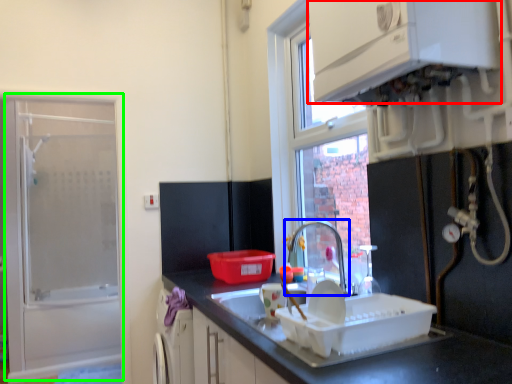
Question: Which object is positioned farthest from cabinetry (highlighted by a red box)? Select from tap (highlighted by a blue box) and screen door (highlighted by a green box).

Choices:
 (A) tap
 (B) screen door

Answer: (B)